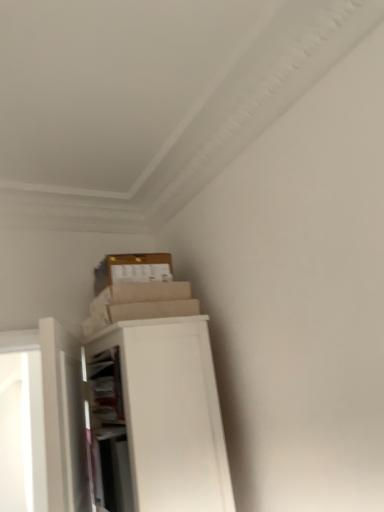
Question: From the image's perspective, is white matte/file cabinet at upper left above or below white matte door at left?

Choices:
 (A) above
 (B) below

Answer: (B)

Question: Relative to white matte door at left, is white matte/file cabinet at upper left in front or behind?

Choices:
 (A) front
 (B) behind

Answer: (B)

Question: From a real-world perspective, is white matte/file cabinet at upper left positioned above or below white matte door at left?

Choices:
 (A) below
 (B) above

Answer: (A)

Question: Is point (54, 448) closer or farther from the camera than point (206, 500)?

Choices:
 (A) farther
 (B) closer

Answer: (B)

Question: From a real-world perspective, is white matte door at left positioned above or below white matte/file cabinet at upper left?

Choices:
 (A) above
 (B) below

Answer: (A)

Question: In the image, is white matte door at left on the left side or the right side of white matte/file cabinet at upper left?

Choices:
 (A) left
 (B) right

Answer: (A)

Question: Looking at the image, does white matte door at left seem bigger or smaller compared to white matte/file cabinet at upper left?

Choices:
 (A) big
 (B) small

Answer: (B)